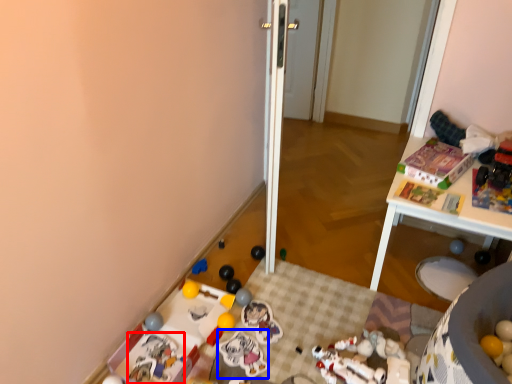
Question: Which object is closer to the camera taking this photo, toy (highlighted by a red box) or toy (highlighted by a blue box)?

Choices:
 (A) toy
 (B) toy

Answer: (A)